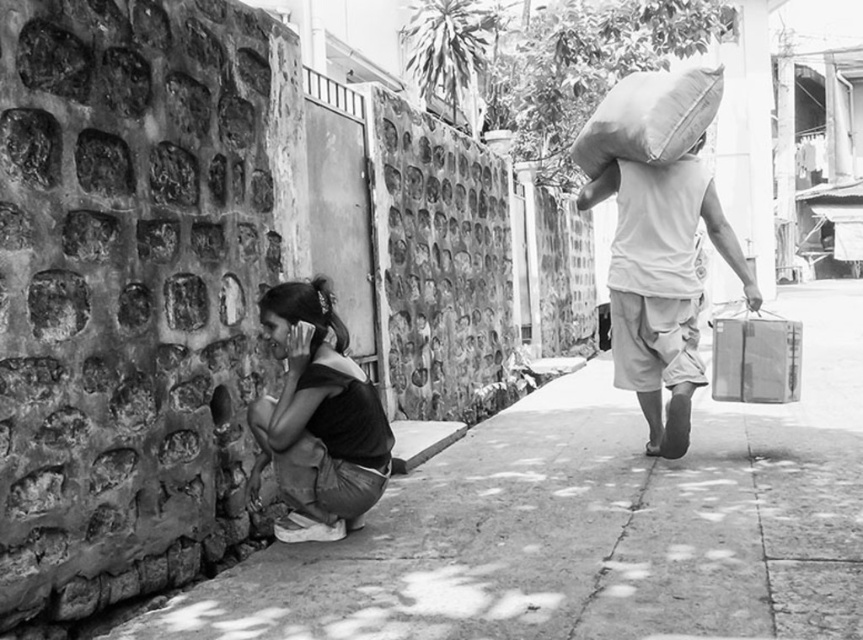
Question: Is dark fabric shirt at lower left to the left of textured brown sack at upper right from the viewer's perspective?

Choices:
 (A) yes
 (B) no

Answer: (A)

Question: Which of these objects is positioned farthest from the matte white shirt at right?

Choices:
 (A) smooth concrete pavement at lower left
 (B) dark fabric shirt at lower left
 (C) metallic gray suitcase at right
 (D) textured brown sack at upper right

Answer: (A)

Question: Does dark fabric shirt at lower left appear on the left side of textured brown sack at upper right?

Choices:
 (A) no
 (B) yes

Answer: (B)

Question: Which point appears farthest from the camera in this image?

Choices:
 (A) (691, 266)
 (B) (734, 372)
 (C) (272, 326)

Answer: (A)

Question: Is smooth concrete pavement at lower left positioned before textured brown sack at upper right?

Choices:
 (A) yes
 (B) no

Answer: (A)

Question: Estimate the real-world distances between objects in this image. Which object is closer to the textured brown sack at upper right?

Choices:
 (A) matte white shirt at right
 (B) metallic gray suitcase at right
 (C) dark fabric shirt at lower left

Answer: (A)